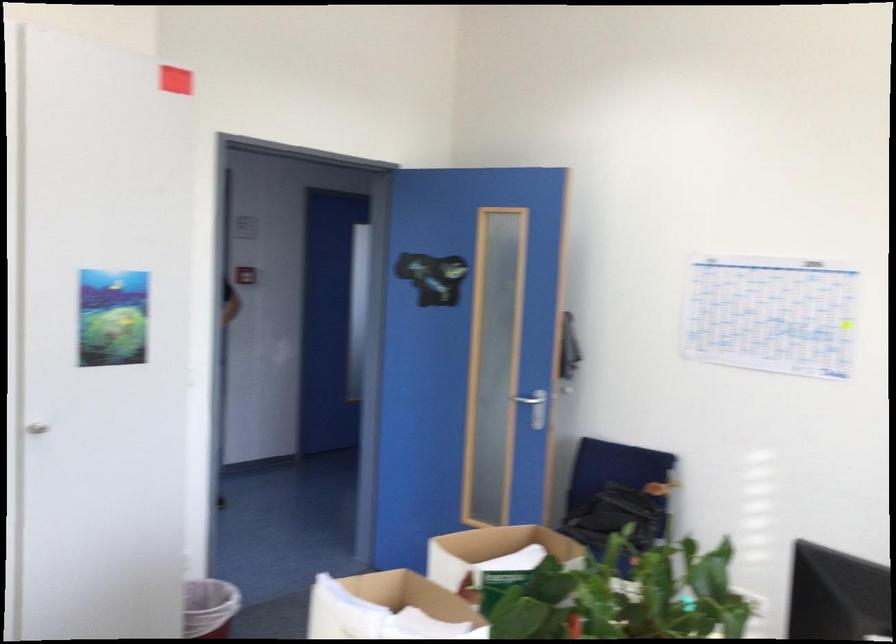
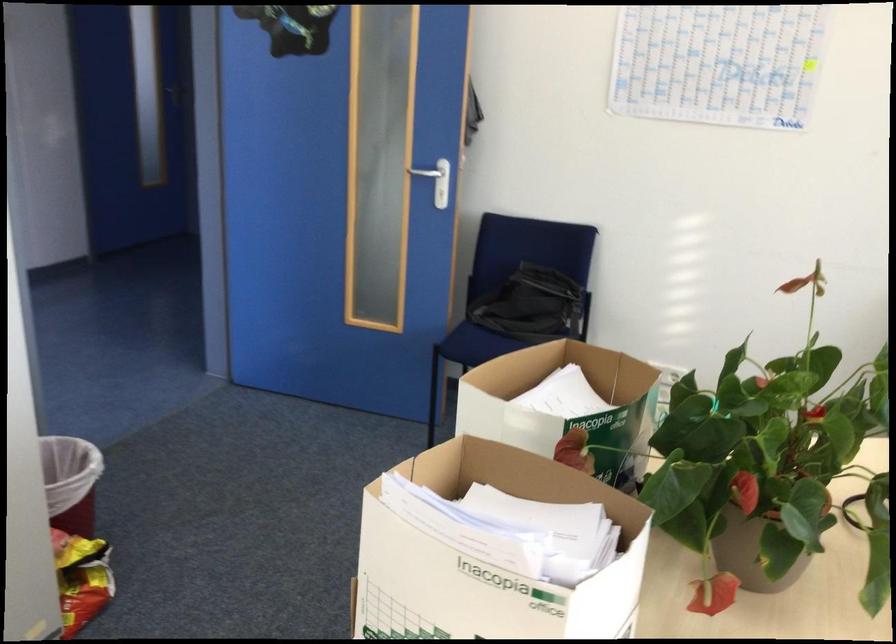
The point at (589, 471) is marked in the first image. Where is the corresponding point in the second image?

(515, 275)